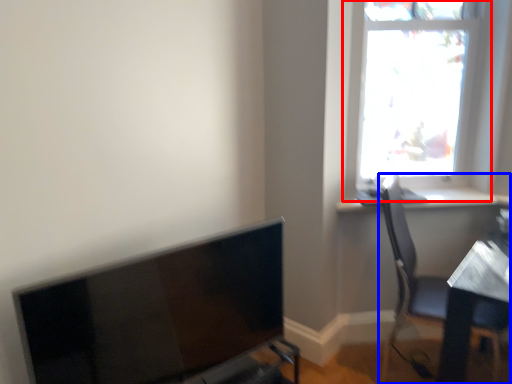
Question: Which of the following is the closest to the observer, window (highlighted by a red box) or chair (highlighted by a blue box)?

Choices:
 (A) window
 (B) chair

Answer: (B)